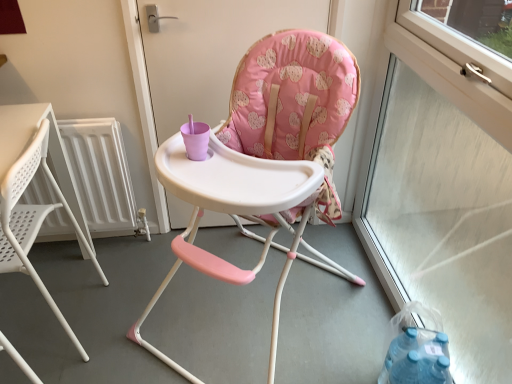
Question: Is pink fabric high chair at center directly adjacent to white metallic radiator at left?

Choices:
 (A) no
 (B) yes

Answer: (A)

Question: Is the depth of pink fabric high chair at center less than that of white metallic radiator at left?

Choices:
 (A) yes
 (B) no

Answer: (A)

Question: Is pink fabric high chair at center oriented towards white metallic radiator at left?

Choices:
 (A) yes
 (B) no

Answer: (B)

Question: Is pink fabric high chair at center far away from white metallic radiator at left?

Choices:
 (A) yes
 (B) no

Answer: (B)

Question: Can you confirm if pink fabric high chair at center is shorter than white metallic radiator at left?

Choices:
 (A) yes
 (B) no

Answer: (B)

Question: In terms of width, does pink fabric high chair at center look wider or thinner when compared to white plastic chair at left, acting as the 2th chair starting from the right?

Choices:
 (A) thin
 (B) wide

Answer: (A)

Question: From their relative heights in the image, would you say pink fabric high chair at center is taller or shorter than white plastic chair at left, acting as the 2th chair starting from the right?

Choices:
 (A) short
 (B) tall

Answer: (B)

Question: Does point (311, 0) appear closer or farther from the camera than point (4, 339)?

Choices:
 (A) farther
 (B) closer

Answer: (A)

Question: Based on their sizes in the image, would you say pink fabric high chair at center is bigger or smaller than white plastic chair at left, acting as the 2th chair starting from the right?

Choices:
 (A) small
 (B) big

Answer: (A)

Question: From a real-world perspective, relative to transparent glass window at right, is matte plastic highchair at center, which is the 1th chair in right-to-left order, vertically above or below?

Choices:
 (A) above
 (B) below

Answer: (B)

Question: Is matte plastic highchair at center, which is the 1th chair in right-to-left order, taller or shorter than transparent glass window at right?

Choices:
 (A) short
 (B) tall

Answer: (A)

Question: Would you say matte plastic highchair at center, the 2th chair from the left, is to the left or to the right of transparent glass window at right in the picture?

Choices:
 (A) left
 (B) right

Answer: (A)

Question: Is matte plastic highchair at center, which is the 1th chair in right-to-left order, in front of or behind transparent glass window at right in the image?

Choices:
 (A) behind
 (B) front

Answer: (A)

Question: From a real-world perspective, is white metallic radiator at left positioned above or below matte plastic highchair at center, the 2th chair from the left?

Choices:
 (A) below
 (B) above

Answer: (A)

Question: Is white metallic radiator at left situated inside matte plastic highchair at center, the 2th chair from the left, or outside?

Choices:
 (A) inside
 (B) outside

Answer: (B)